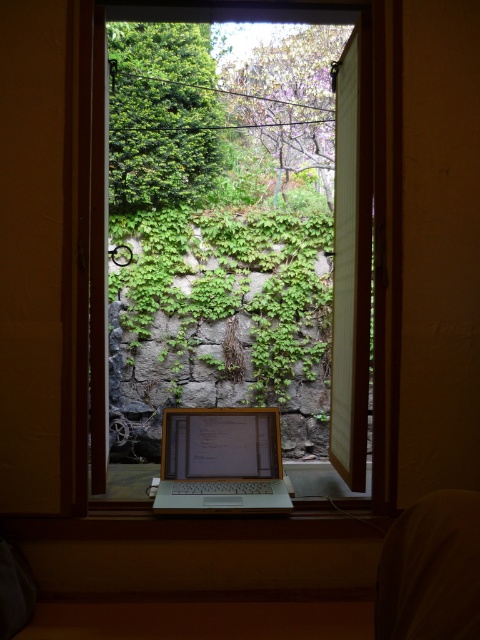
Question: Based on their relative distances, which object is farther from the green leafy ivy at upper left?

Choices:
 (A) dark fabric at lower right
 (B) satin silver laptop at center

Answer: (A)

Question: Does green leafy ivy at upper left have a smaller size compared to satin silver laptop at center?

Choices:
 (A) yes
 (B) no

Answer: (B)

Question: Is the position of transparent glass window at center less distant than that of dark fabric at lower right?

Choices:
 (A) no
 (B) yes

Answer: (A)

Question: Among these objects, which one is nearest to the camera?

Choices:
 (A) green leafy ivy at upper left
 (B) transparent glass window at center

Answer: (B)

Question: Which object appears farthest from the camera in this image?

Choices:
 (A) transparent glass window at center
 (B) green leafy ivy at upper left
 (C) satin silver laptop at center

Answer: (B)

Question: Is green leafy ivy at upper left to the right of satin silver laptop at center from the viewer's perspective?

Choices:
 (A) yes
 (B) no

Answer: (B)